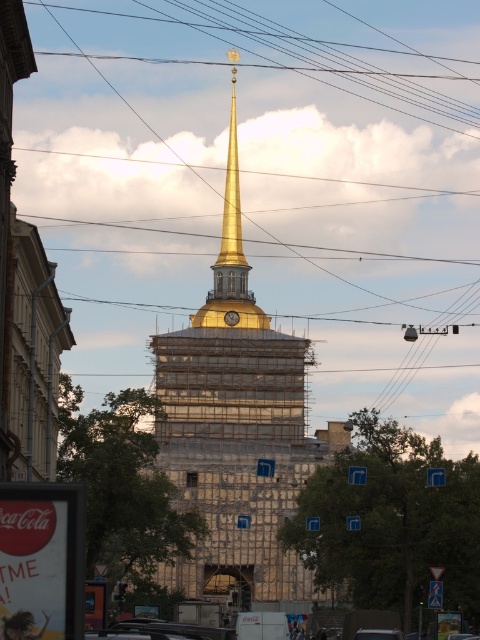
Which is more to the right, gold metallic spire at center or gold polished spire at center?

Positioned to the right is gold metallic spire at center.

I want to click on gold metallic spire at center, so pyautogui.click(x=237, y=429).

Where is `gold metallic spire at center`? Image resolution: width=480 pixels, height=640 pixels. gold metallic spire at center is located at coordinates (237, 429).

Does point (256, 412) come in front of point (453, 116)?

Yes, it is in front of point (453, 116).

Is gold metallic spire at center taller than metallic wire at upper center?

Yes, gold metallic spire at center is taller than metallic wire at upper center.

Image resolution: width=480 pixels, height=640 pixels. What do you see at coordinates (237, 429) in the screenshot? I see `gold metallic spire at center` at bounding box center [237, 429].

This screenshot has height=640, width=480. Identify the location of gold metallic spire at center. (237, 429).

Consider the image. Is metallic wire at upper center smaller than gold polished spire at center?

Yes, metallic wire at upper center is smaller than gold polished spire at center.

Can you confirm if metallic wire at upper center is positioned above gold polished spire at center?

Correct, metallic wire at upper center is located above gold polished spire at center.

You are a GUI agent. You are given a task and a screenshot of the screen. Output one action in this format:
    pyautogui.click(x=<x>, y=<y>)
    Task: Click on the metallic wire at upper center
    This screenshot has width=480, height=640.
    Given the screenshot: What is the action you would take?
    point(314,54)